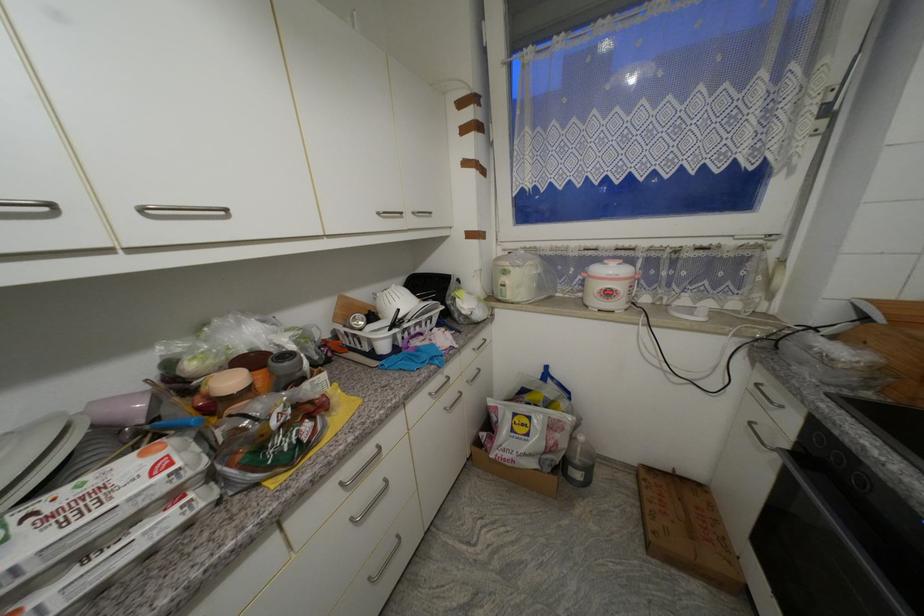
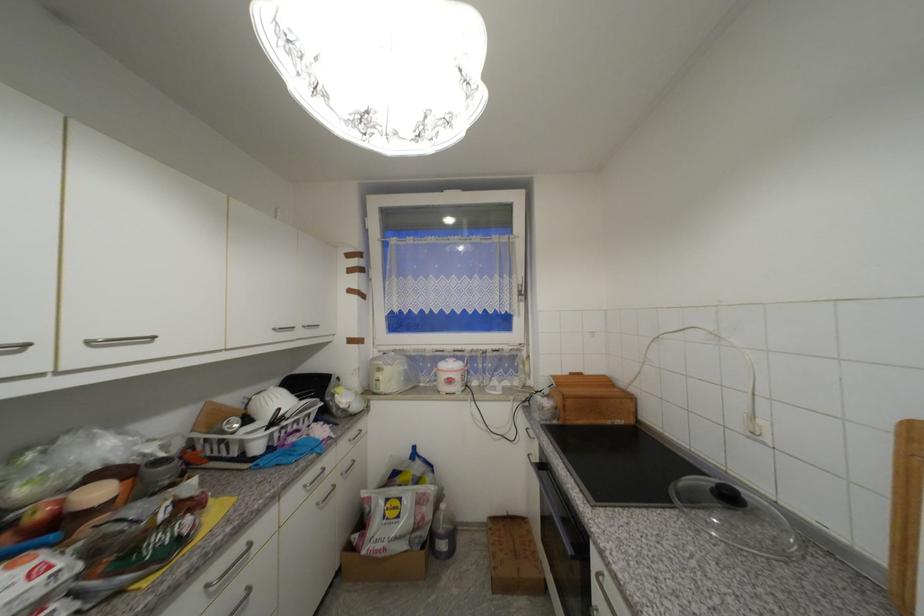
Find the pixel in the second image that matches point (435, 395) in the first image.

(310, 488)